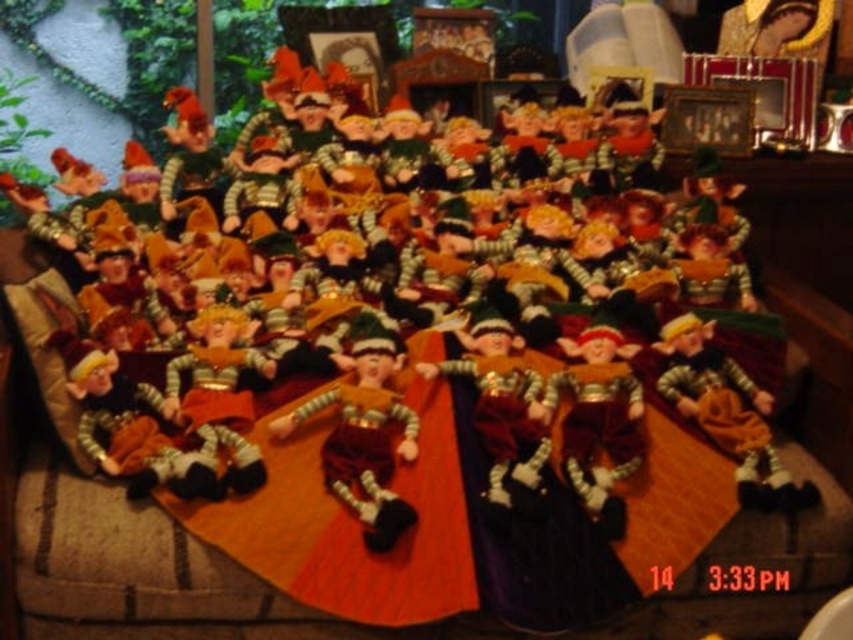
Question: Estimate the real-world distances between objects in this image. Which object is closer to the velvet maroon elf at center?

Choices:
 (A) velvet-like brown elf at center
 (B) velvet plush elf at center
 (C) velvet orange elf at center
 (D) velvet-like red elf at center

Answer: (D)

Question: Is velvet maroon elf at center below velvet orange elf at center?

Choices:
 (A) no
 (B) yes

Answer: (B)

Question: Can you confirm if velvet plush elf at center is positioned below velvet-like red elf at center?

Choices:
 (A) no
 (B) yes

Answer: (B)

Question: Which point is farther to the camera?

Choices:
 (A) (689, 390)
 (B) (381, 445)
 (C) (122, 394)

Answer: (A)

Question: Is the position of velvet orange elf at center more distant than that of velvet-like brown elf at center?

Choices:
 (A) yes
 (B) no

Answer: (A)

Question: Which object is the farthest from the velvet plush elf at center?

Choices:
 (A) velvet maroon elf at center
 (B) velvet orange elf at center
 (C) velvet-like brown elf at center

Answer: (B)